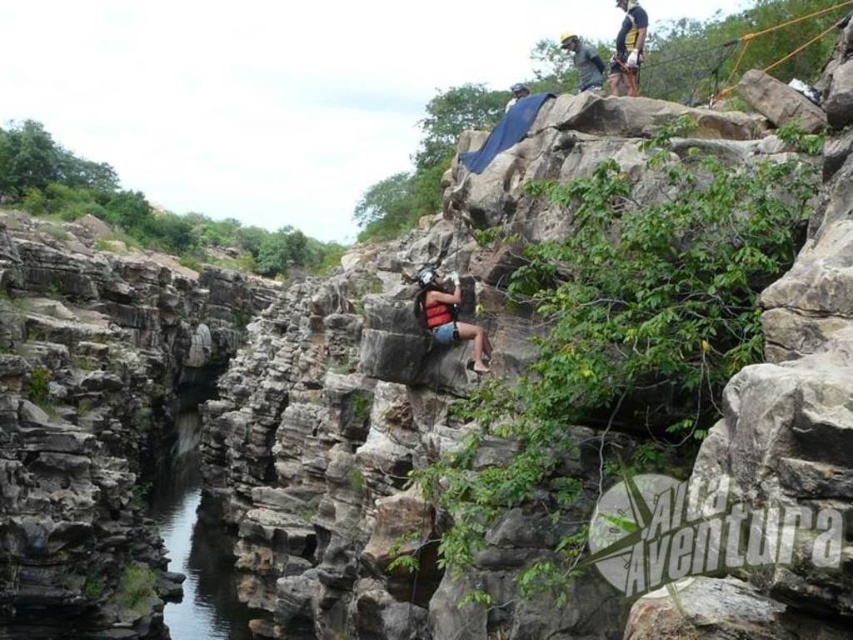
Is point (666, 48) positioned after point (637, 56)?

Yes, point (666, 48) is farther from viewer.

Is orange nylon rope bridge at upper right shorter than matte black helmet at upper center?

No.

Where is `orange nylon rope bridge at upper right`? The image size is (853, 640). orange nylon rope bridge at upper right is located at coordinates (737, 45).

How much distance is there between orange nylon rope bridge at upper right and matte red life vest at center?

50.72 meters

Who is lower down, orange nylon rope bridge at upper right or matte red life vest at center?

matte red life vest at center is lower down.

I want to click on orange nylon rope bridge at upper right, so click(737, 45).

Identify the location of orange nylon rope bridge at upper right. This screenshot has width=853, height=640. (737, 45).

In order to click on matte black helmet at upper center in this screenshot , I will do `click(628, 48)`.